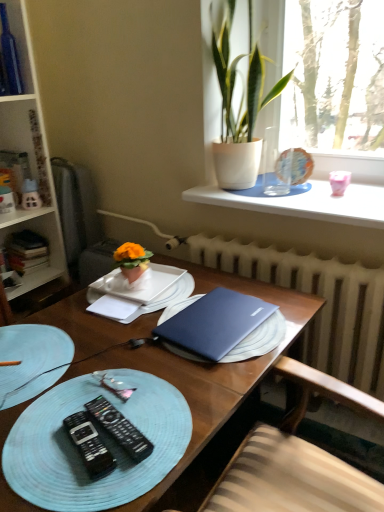
You are a GUI agent. You are given a task and a screenshot of the screen. Output one action in this format:
    pyautogui.click(x=<x>, y=<y>)
    Task: Click on the black plastic remote control at lower left, which ranks as the second remote control in left-to-right order
    
    Given the screenshot: What is the action you would take?
    pyautogui.click(x=120, y=428)

How much space does black plastic remote control at lower left, the first remote control in the right-to-left sequence, occupy horizontally?

The width of black plastic remote control at lower left, the first remote control in the right-to-left sequence, is 2.42 inches.

This screenshot has height=512, width=384. I want to click on matte orange flowerpot at center, the first houseplant from the left, so click(132, 260).

Measure the distance between blue matte laptop at center and camera.

28.70 inches.

Where is `white radiator at center`? Image resolution: width=384 pixels, height=512 pixels. white radiator at center is located at coordinates (324, 305).

Locate an element on the screen. Image resolution: width=384 pixels, height=512 pixels. white smooth window sill at upper center is located at coordinates pos(304,202).

You are a GUI agent. You are given a task and a screenshot of the screen. Output one action in this format:
    pyautogui.click(x=<x>, y=<y>)
    Task: Click on the white wooden bookcase at left
    This screenshot has height=512, width=384.
    Given the screenshot: What is the action you would take?
    pyautogui.click(x=32, y=177)

Is black plastic remote control at lower left, positioned as the 1th remote control in left-to-right order, behind light blue woven placemat at lower left?

That is True.

In the scene shown: From a real-world perspective, is black plastic remote control at lower left, positioned as the 1th remote control in left-to-right order, positioned over light blue woven placemat at lower left based on gravity?

Yes, from a real-world perspective, black plastic remote control at lower left, positioned as the 1th remote control in left-to-right order, is over light blue woven placemat at lower left

How distant is black plastic remote control at lower left, acting as the second remote control starting from the right, from light blue woven placemat at lower left?

black plastic remote control at lower left, acting as the second remote control starting from the right, and light blue woven placemat at lower left are 3.11 inches apart from each other.

How many degrees apart are the facing directions of black plastic remote control at lower left, acting as the second remote control starting from the right, and white matte notebook at center?

They differ by 27.4 degrees in their facing directions.

From the image's perspective, is black plastic remote control at lower left, positioned as the 1th remote control in left-to-right order, beneath white matte notebook at center?

Yes.

From a real-world perspective, is black plastic remote control at lower left, positioned as the 1th remote control in left-to-right order, beneath white matte notebook at center?

Actually, black plastic remote control at lower left, positioned as the 1th remote control in left-to-right order, is physically above white matte notebook at center in the real world.

The height and width of the screenshot is (512, 384). Identify the location of remote control that is the 1st object above the white matte notebook at center (from a real-world perspective). (89, 445).

Which object is positioned more to the right, black plastic remote control at lower left, acting as the second remote control starting from the right, or hardcover books at left?

black plastic remote control at lower left, acting as the second remote control starting from the right.

Are black plastic remote control at lower left, positioned as the 1th remote control in left-to-right order, and hardcover books at left beside each other?

No, black plastic remote control at lower left, positioned as the 1th remote control in left-to-right order, is not next to hardcover books at left.

Is black plastic remote control at lower left, acting as the second remote control starting from the right, oriented towards hardcover books at left?

No.

Is black plastic remote control at lower left, positioned as the 1th remote control in left-to-right order, bigger than hardcover books at left?

No, black plastic remote control at lower left, positioned as the 1th remote control in left-to-right order, is not bigger than hardcover books at left.

Locate an element on the screen. The image size is (384, 512). radiator to the right of blue woven placemat at lower left, acting as the second tableware starting from the right is located at coordinates (324, 305).

Is blue woven placemat at lower left, the 2th tableware viewed from the back, directly adjacent to white radiator at center?

blue woven placemat at lower left, the 2th tableware viewed from the back, and white radiator at center are clearly separated.

From a real-world perspective, between blue woven placemat at lower left, acting as the second tableware starting from the right, and white radiator at center, who is vertically lower?

white radiator at center, from a real-world perspective.

Is blue woven placemat at lower left, which appears as the 1th tableware when viewed from the left, smaller than white radiator at center?

Indeed, blue woven placemat at lower left, which appears as the 1th tableware when viewed from the left, has a smaller size compared to white radiator at center.

From a real-world perspective, between light blue woven placemat at lower left and black plastic remote control at lower left, the first remote control in the right-to-left sequence, who is vertically lower?

light blue woven placemat at lower left.

Considering their positions, is light blue woven placemat at lower left located in front of or behind black plastic remote control at lower left, the first remote control in the right-to-left sequence?

Clearly, light blue woven placemat at lower left is in front of black plastic remote control at lower left, the first remote control in the right-to-left sequence.

Locate an element on the screen. remote control that is the 2nd one above the light blue woven placemat at lower left (from a real-world perspective) is located at coordinates (120, 428).

Is light blue woven placemat at lower left facing towards black plastic remote control at lower left, the first remote control in the right-to-left sequence?

Yes, light blue woven placemat at lower left is oriented towards black plastic remote control at lower left, the first remote control in the right-to-left sequence.

Considering the positions of objects black plastic remote control at lower left, the first remote control in the right-to-left sequence, and pink glossy coffee cup at upper right in the image provided, who is in front, black plastic remote control at lower left, the first remote control in the right-to-left sequence, or pink glossy coffee cup at upper right?

Positioned in front is black plastic remote control at lower left, the first remote control in the right-to-left sequence.

Where is `remote control that is the 1st object located in front of the pink glossy coffee cup at upper right`? The width and height of the screenshot is (384, 512). remote control that is the 1st object located in front of the pink glossy coffee cup at upper right is located at coordinates (120, 428).

Does black plastic remote control at lower left, the first remote control in the right-to-left sequence, have a greater height compared to pink glossy coffee cup at upper right?

No.

Does point (68, 371) come farther from viewer compared to point (108, 493)?

That is True.

How many degrees apart are the facing directions of blue matte laptop at center and light blue woven placemat at lower left?

There is a 91.1-degree angle between the facing directions of blue matte laptop at center and light blue woven placemat at lower left.

Between blue matte laptop at center and light blue woven placemat at lower left, which one has smaller size?

light blue woven placemat at lower left.

From a real-world perspective, is blue matte laptop at center physically above light blue woven placemat at lower left?

Incorrect, from a real-world perspective, blue matte laptop at center is lower than light blue woven placemat at lower left.

Where is `remote control that is on the left side of light blue woven placemat at lower left`? The image size is (384, 512). remote control that is on the left side of light blue woven placemat at lower left is located at coordinates (89, 445).

I want to click on remote control that is the 1st object to the right of the white matte notebook at center, starting at the anchor, so click(x=89, y=445).

Considering their positions, is hardcover books at left positioned closer to matte white house at left than white smooth window sill at upper center?

Based on the image, hardcover books at left appears to be nearer to matte white house at left.

Based on their spatial positions, is white matte notebook at center or matte orange flowerpot at center, the 2th houseplant from the right, further from hardcover books at left?

Among the two, white matte notebook at center is located further to hardcover books at left.

Based on their spatial positions, is pink glossy coffee cup at upper right or green leafy plant at upper right, positioned as the first houseplant in right-to-left order, closer to matte white house at left?

green leafy plant at upper right, positioned as the first houseplant in right-to-left order.

When comparing their distances from matte white house at left, does hardcover books at left or matte orange flowerpot at center, the first houseplant from the left, seem closer?

The object closer to matte white house at left is hardcover books at left.

Estimate the real-world distances between objects in this image. Which object is closer to black plastic remote control at lower left, the first remote control in the right-to-left sequence, light blue woven placemat at lower left or white smooth window sill at upper center?

light blue woven placemat at lower left is closer to black plastic remote control at lower left, the first remote control in the right-to-left sequence.

Which object lies further to the anchor point white radiator at center, green leafy plant at upper right, positioned as the first houseplant in right-to-left order, or blue glass bottle at upper left?

blue glass bottle at upper left is positioned further to the anchor white radiator at center.

When comparing their distances from green leafy plant at upper right, placed as the 2th houseplant when sorted from bottom to top, does black plastic remote control at lower left, acting as the second remote control starting from the right, or hardcover books at left seem further?

black plastic remote control at lower left, acting as the second remote control starting from the right.

Looking at the image, which one is located further to matte orange flowerpot at center, which is the second houseplant in top-to-bottom order, blue glass bottle at upper left or matte white house at left?

blue glass bottle at upper left is further to matte orange flowerpot at center, which is the second houseplant in top-to-bottom order.

At what (x,y) coordinates should I click in order to perform the action: click on notebook between matte white house at left and green leafy plant at upper right, arranged as the 1th houseplant when viewed from the top, in the horizontal direction. Please return your answer as a coordinate pair (x, y). Looking at the image, I should click on pos(113,307).

You are a GUI agent. You are given a task and a screenshot of the screen. Output one action in this format:
    pyautogui.click(x=<x>, y=<y>)
    Task: Click on the houseplant located between white matte notebook at center and satin blue laptop at center in the left-right direction
    
    Given the screenshot: What is the action you would take?
    pyautogui.click(x=132, y=260)

Where is `laptop between matte white house at left and pink glossy coffee cup at upper right`? The image size is (384, 512). laptop between matte white house at left and pink glossy coffee cup at upper right is located at coordinates (222, 327).

Identify the location of toy between white wooden bookcase at left and matte glass globe at upper right, which is the 2th tableware in left-to-right order, in the horizontal direction. (30, 195).